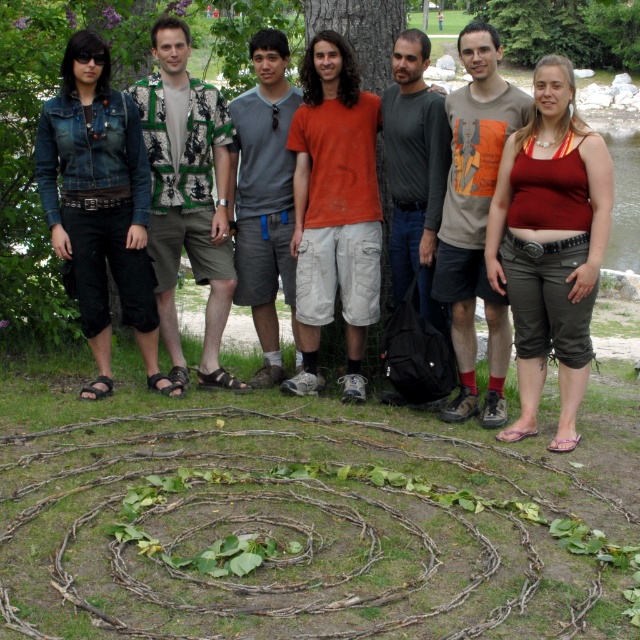
You are standing in the park and see the group of people. The woman in the denim jacket at left is holding a map. She wants to give the map to the person wearing the matte red tank top at right. Can she hand it directly to them without moving from her spot?

The matte red tank top at right is to the right of the denim jacket at left, so the woman in the denim jacket at left can hand the map directly to the person in the matte red tank top at right as they are positioned next to each other.

You are standing at the point labeled point (280, 356) and want to see the point labeled point (72, 84). Which direction should you face to look towards it?

You should face north because point (72, 84) is north of point (280, 356).